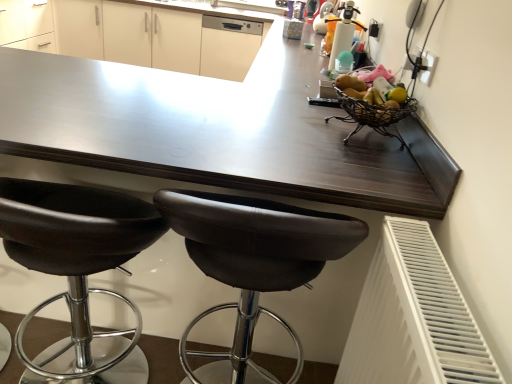
Question: In terms of size, does white plastic radiator at lower right appear bigger or smaller than white matte cabinet at upper center?

Choices:
 (A) small
 (B) big

Answer: (A)

Question: From their relative heights in the image, would you say white plastic radiator at lower right is taller or shorter than white matte cabinet at upper center?

Choices:
 (A) short
 (B) tall

Answer: (A)

Question: Which object is positioned farthest from the white glossy dishwasher at upper center?

Choices:
 (A) white matte cabinet at upper center
 (B) white plastic radiator at lower right
 (C) black leather stool at lower left, the second chair viewed from the right
 (D) brown leather stool at center, which ranks as the first chair in right-to-left order
 (E) black plastic socket at upper right

Answer: (B)

Question: Which object is the farthest from the white matte cabinet at upper center?

Choices:
 (A) white glossy dishwasher at upper center
 (B) black plastic socket at upper right
 (C) brown leather stool at center, which is the second chair in left-to-right order
 (D) black leather stool at lower left, arranged as the first chair when viewed from the left
 (E) white plastic radiator at lower right

Answer: (E)